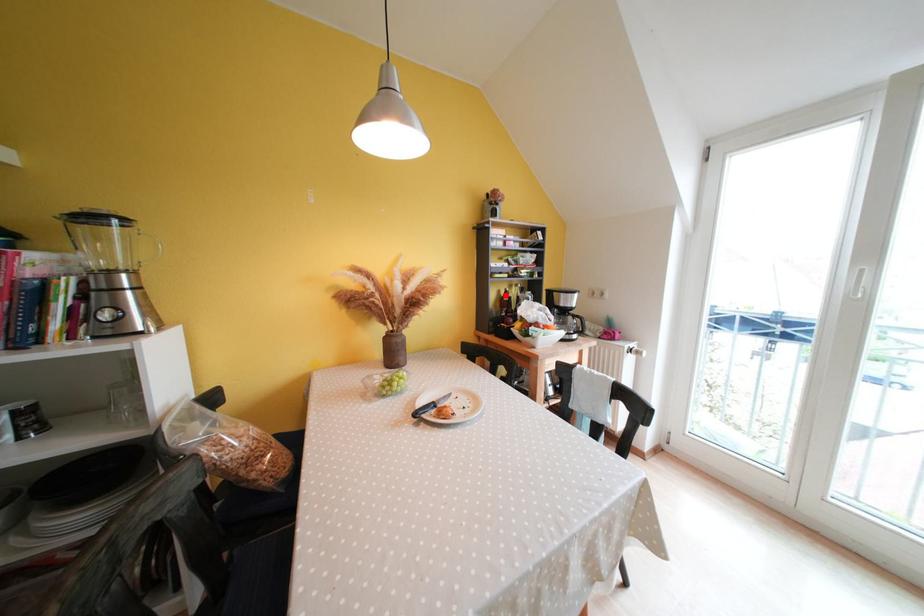
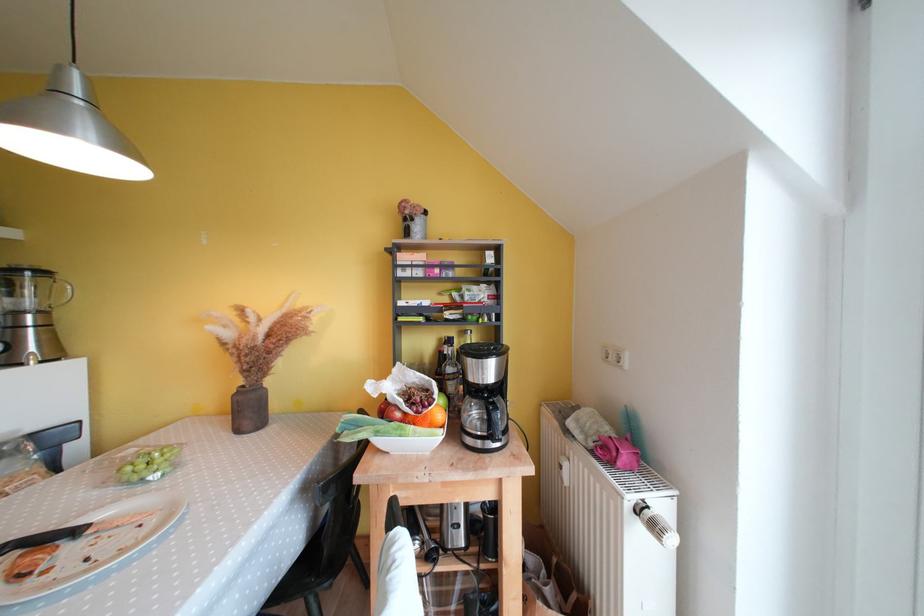
Find the pixel in the second image that matches the highlighted location in the first image.

(446, 342)